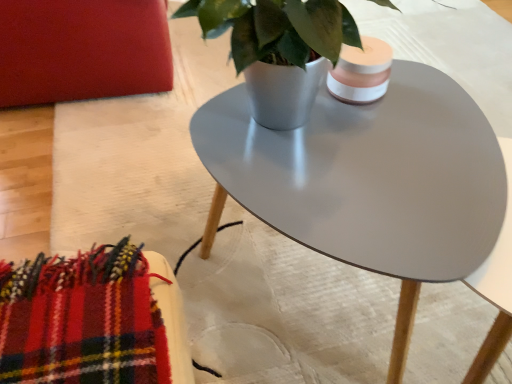
Question: Considering the relative sizes of matte gray pot at center and matte gray coffee table at center in the image provided, is matte gray pot at center smaller than matte gray coffee table at center?

Choices:
 (A) yes
 (B) no

Answer: (A)

Question: Is matte gray pot at center positioned behind matte gray coffee table at center?

Choices:
 (A) no
 (B) yes

Answer: (A)

Question: Is matte gray pot at center looking in the opposite direction of matte gray coffee table at center?

Choices:
 (A) no
 (B) yes

Answer: (A)

Question: Can you confirm if matte gray pot at center is bigger than matte gray coffee table at center?

Choices:
 (A) no
 (B) yes

Answer: (A)

Question: Is matte gray pot at center placed right next to matte gray coffee table at center?

Choices:
 (A) no
 (B) yes

Answer: (A)

Question: From the image's perspective, is matte red armchair at upper left located above or below matte gray coffee table at center?

Choices:
 (A) above
 (B) below

Answer: (A)

Question: Is point (102, 64) positioned closer to the camera than point (437, 261)?

Choices:
 (A) farther
 (B) closer

Answer: (A)

Question: From a real-world perspective, is matte red armchair at upper left positioned above or below matte gray coffee table at center?

Choices:
 (A) below
 (B) above

Answer: (A)

Question: Is matte red armchair at upper left in front of or behind matte gray coffee table at center in the image?

Choices:
 (A) front
 (B) behind

Answer: (B)

Question: Considering the positions of matte gray pot at center and matte red armchair at upper left in the image, is matte gray pot at center bigger or smaller than matte red armchair at upper left?

Choices:
 (A) small
 (B) big

Answer: (A)

Question: From a real-world perspective, is matte gray pot at center above or below matte red armchair at upper left?

Choices:
 (A) below
 (B) above

Answer: (B)

Question: Considering the positions of matte gray pot at center and matte red armchair at upper left in the image, is matte gray pot at center taller or shorter than matte red armchair at upper left?

Choices:
 (A) tall
 (B) short

Answer: (B)

Question: In terms of width, does matte gray pot at center look wider or thinner when compared to matte red armchair at upper left?

Choices:
 (A) wide
 (B) thin

Answer: (B)

Question: Considering the positions of matte gray coffee table at center and matte red armchair at upper left in the image, is matte gray coffee table at center wider or thinner than matte red armchair at upper left?

Choices:
 (A) wide
 (B) thin

Answer: (B)

Question: Does point (243, 198) appear closer or farther from the camera than point (121, 29)?

Choices:
 (A) farther
 (B) closer

Answer: (B)